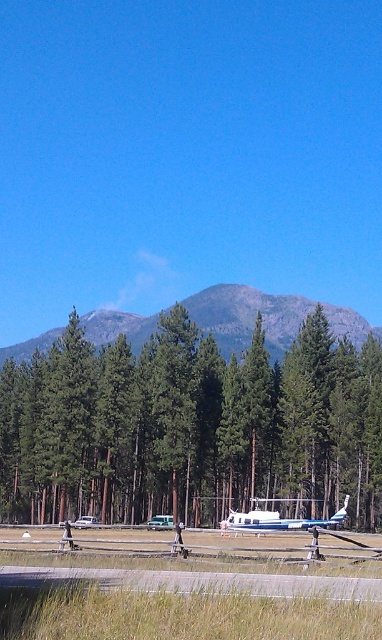
You are a pilot preparing to take off from the gray concrete runway at lower center. You notice a green matte tree at center nearby. Based on the scene, which object is taller and could potentially interfere with your takeoff path?

The green matte tree at center is much taller than the gray concrete runway at lower center, so it could potentially interfere with your takeoff path.

You are a pilot trying to land your helicopter on the gray concrete runway at lower center. You notice a green matte tree at center nearby. Which side of the runway should you avoid to prevent hitting the tree?

The green matte tree at center is located to the left of the gray concrete runway at lower center, so you should avoid the left side of the runway to prevent hitting the tree.